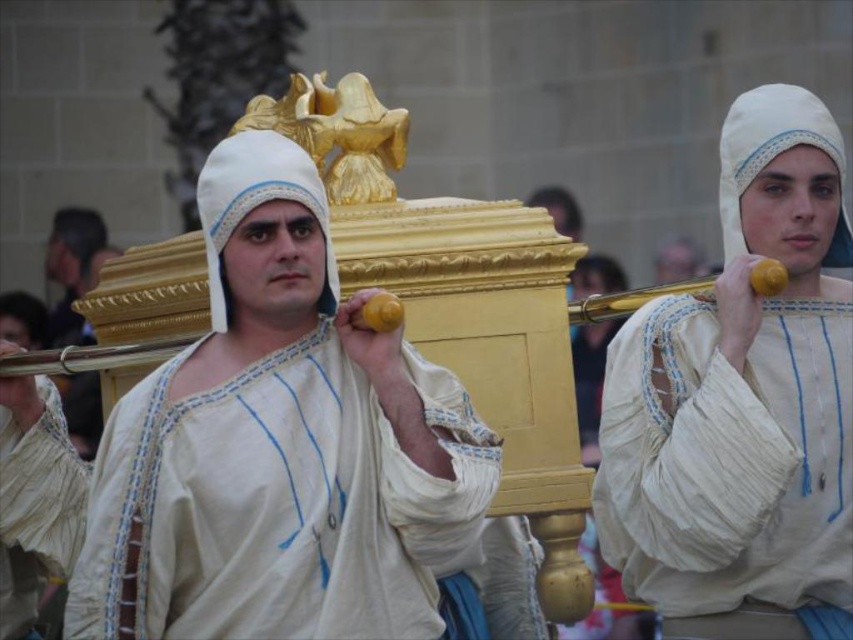
Question: Observing the image, what is the correct spatial positioning of white cotton headscarf at upper right in reference to matte white robe at center?

Choices:
 (A) right
 (B) left

Answer: (A)

Question: Which point appears closest to the camera in this image?

Choices:
 (A) pos(93,435)
 (B) pos(251,168)
 (C) pos(735,211)

Answer: (B)

Question: Estimate the real-world distances between objects in this image. Which object is closer to the white cotton headscarf at upper right?

Choices:
 (A) matte white robe at center
 (B) matte gold casket at center

Answer: (B)

Question: Can you confirm if matte gold casket at center is thinner than white cotton headscarf at upper right?

Choices:
 (A) yes
 (B) no

Answer: (B)

Question: Is matte gold casket at center to the left of white cotton headscarf at upper right from the viewer's perspective?

Choices:
 (A) no
 (B) yes

Answer: (B)

Question: Among these objects, which one is farthest from the camera?

Choices:
 (A) white cotton headscarf at upper right
 (B) matte gold casket at center

Answer: (A)